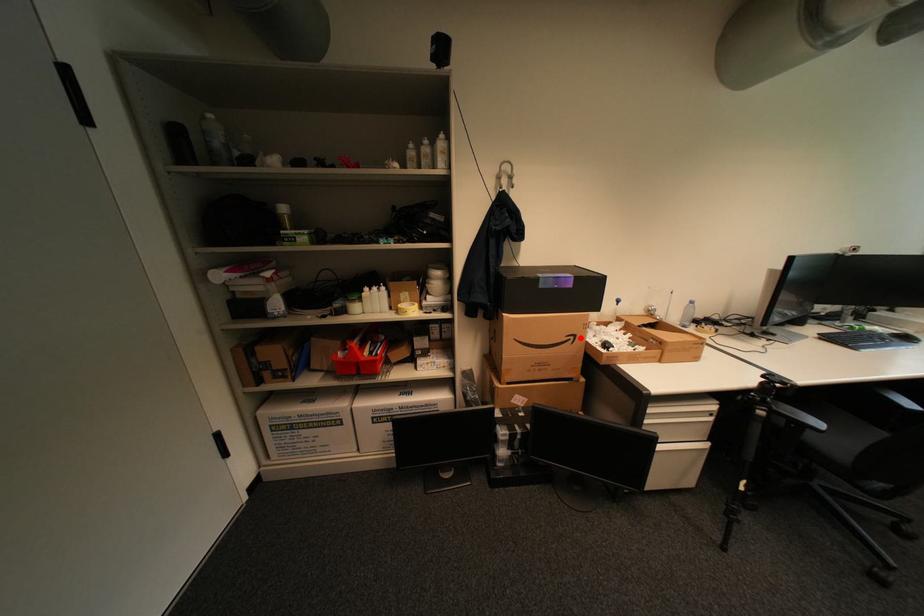
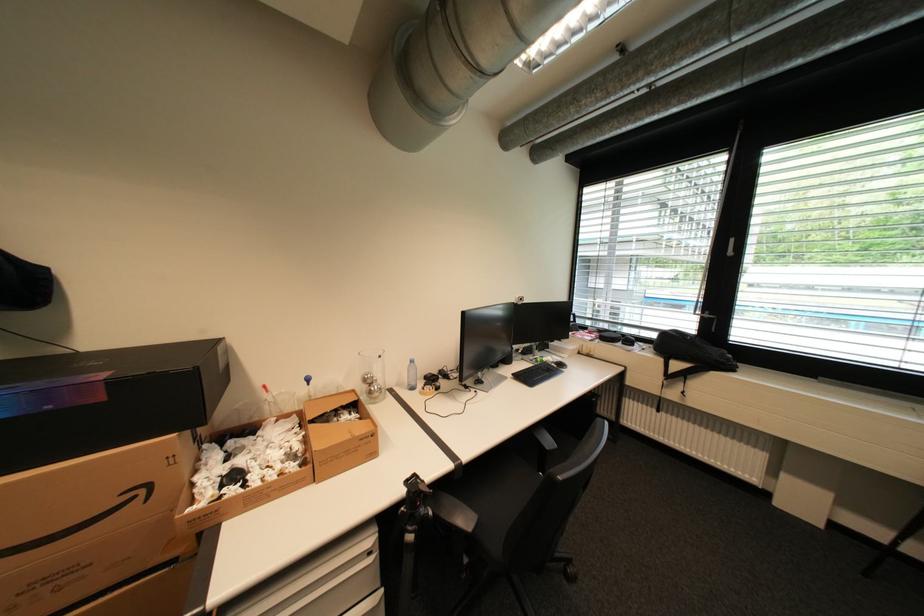
Find the pixel in the second image that matches the highlighted location in the first image.

(151, 491)